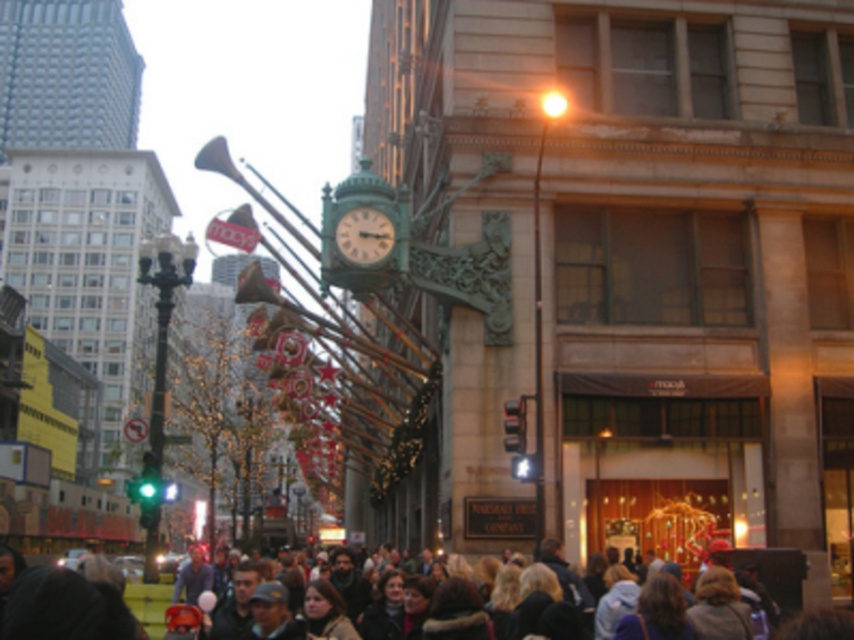
Between dark brown hair at lower center and black metal pole at left, which one is positioned lower?

Positioned lower is dark brown hair at lower center.

Which is more to the left, dark brown hair at lower center or black metal pole at left?

black metal pole at left is more to the left.

Which is behind, point (9, 609) or point (149, 417)?

Positioned behind is point (149, 417).

The width and height of the screenshot is (854, 640). I want to click on dark brown hair at lower center, so click(61, 609).

Which is in front, point (61, 568) or point (382, 228)?

Positioned in front is point (61, 568).

Measure the distance between point (33,636) and camera.

They are 96.43 feet apart.

You are a GUI agent. You are given a task and a screenshot of the screen. Output one action in this format:
    pyautogui.click(x=<x>, y=<y>)
    Task: Click on the dark brown hair at lower center
    Image resolution: width=854 pixels, height=640 pixels.
    Given the screenshot: What is the action you would take?
    pyautogui.click(x=61, y=609)

Where is `black metal pole at left`? The height and width of the screenshot is (640, 854). black metal pole at left is located at coordinates (159, 372).

Can you confirm if black metal pole at left is thinner than green painted metal clock at center?

In fact, black metal pole at left might be wider than green painted metal clock at center.

Measure the distance between black metal pole at left and camera.

A distance of 175.95 feet exists between black metal pole at left and camera.

Locate an element on the screen. black metal pole at left is located at coordinates (159, 372).